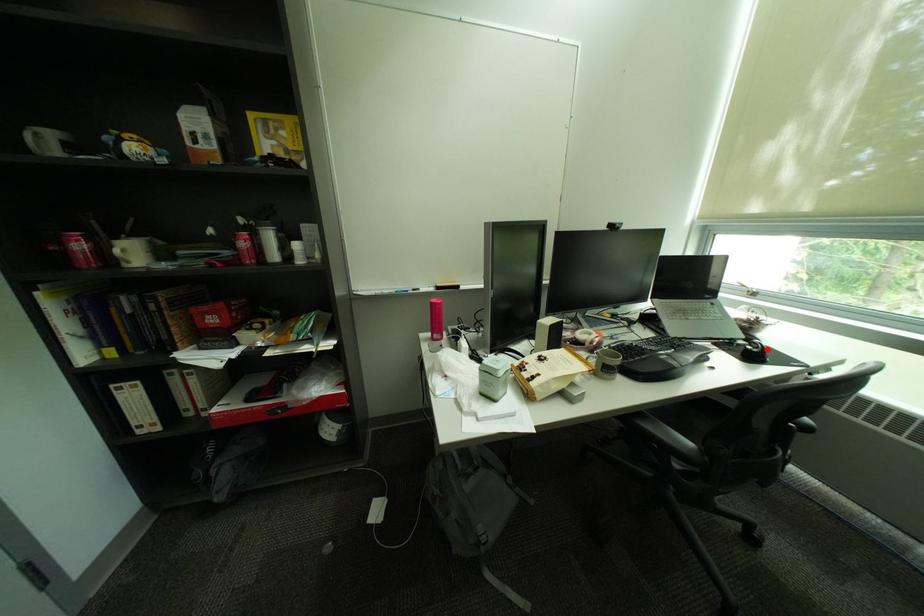
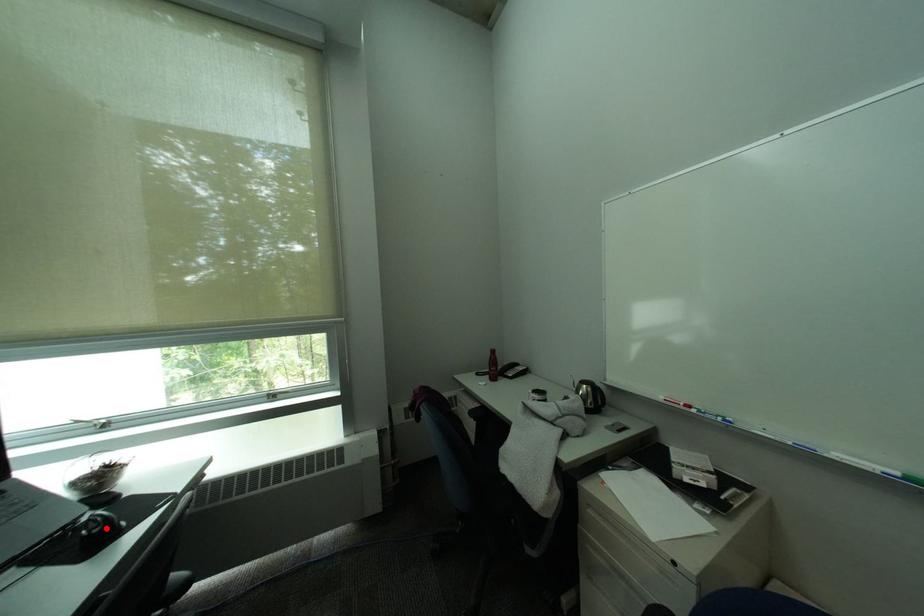
I am providing you with two images of the same scene from different viewpoints. A red point is marked on the first image and another point is marked on the second image. Are the points marked in image1 and image2 representing the same 3D position?

Yes